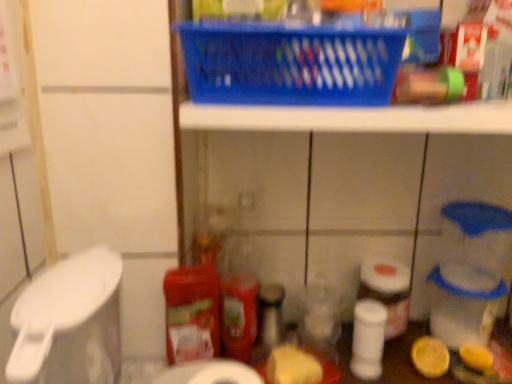
Question: Is the depth of white matte toilet paper at center, which is the 2th toilet paper from back to front, greater than that of white matte toilet paper at lower right, which is the 3th toilet paper from left to right?

Choices:
 (A) yes
 (B) no

Answer: (B)

Question: Considering the relative sizes of white matte toilet paper at center, which is the 2th toilet paper from back to front, and white matte toilet paper at lower right, which is the 3th toilet paper from left to right, in the image provided, is white matte toilet paper at center, which is the 2th toilet paper from back to front, bigger than white matte toilet paper at lower right, which is the 3th toilet paper from left to right,?

Choices:
 (A) no
 (B) yes

Answer: (B)

Question: Considering the relative sizes of white matte toilet paper at center, the second toilet paper positioned from the front, and white matte toilet paper at lower right, the first toilet paper from the right, in the image provided, is white matte toilet paper at center, the second toilet paper positioned from the front, wider than white matte toilet paper at lower right, the first toilet paper from the right,?

Choices:
 (A) yes
 (B) no

Answer: (A)

Question: Considering the relative sizes of white matte toilet paper at center, which is the 2th toilet paper from back to front, and white matte toilet paper at lower right, the first toilet paper from the right, in the image provided, is white matte toilet paper at center, which is the 2th toilet paper from back to front, smaller than white matte toilet paper at lower right, the first toilet paper from the right,?

Choices:
 (A) yes
 (B) no

Answer: (B)

Question: Does white matte toilet paper at center, the second toilet paper positioned from the front, appear on the left side of white matte toilet paper at lower right, the third toilet paper viewed from the front?

Choices:
 (A) yes
 (B) no

Answer: (A)

Question: From a real-world perspective, is white matte toilet paper at center, positioned as the 2th toilet paper in left-to-right order, beneath white matte toilet paper at lower right, the third toilet paper viewed from the front?

Choices:
 (A) no
 (B) yes

Answer: (A)

Question: From the image's perspective, is white matte toilet paper at lower right, which is the 3th toilet paper from left to right, on top of blue plastic basket at upper center?

Choices:
 (A) no
 (B) yes

Answer: (A)

Question: Is white matte toilet paper at lower right, placed as the first toilet paper when sorted from back to front, to the left of blue plastic basket at upper center from the viewer's perspective?

Choices:
 (A) no
 (B) yes

Answer: (A)

Question: Are white matte toilet paper at lower right, which is the 3th toilet paper from left to right, and blue plastic basket at upper center far apart?

Choices:
 (A) no
 (B) yes

Answer: (A)

Question: Can you confirm if white matte toilet paper at lower right, placed as the first toilet paper when sorted from back to front, is smaller than blue plastic basket at upper center?

Choices:
 (A) yes
 (B) no

Answer: (A)

Question: Is white matte toilet paper at lower right, the third toilet paper viewed from the front, thinner than blue plastic basket at upper center?

Choices:
 (A) yes
 (B) no

Answer: (A)

Question: Is the surface of white matte toilet paper at lower right, the first toilet paper from the right, in direct contact with blue plastic basket at upper center?

Choices:
 (A) no
 (B) yes

Answer: (A)

Question: From the image's perspective, does white matte toilet paper at lower right, which is the 3th toilet paper from left to right, appear higher than white matte toilet paper at lower center, arranged as the 1th toilet paper when viewed from the front?

Choices:
 (A) yes
 (B) no

Answer: (A)